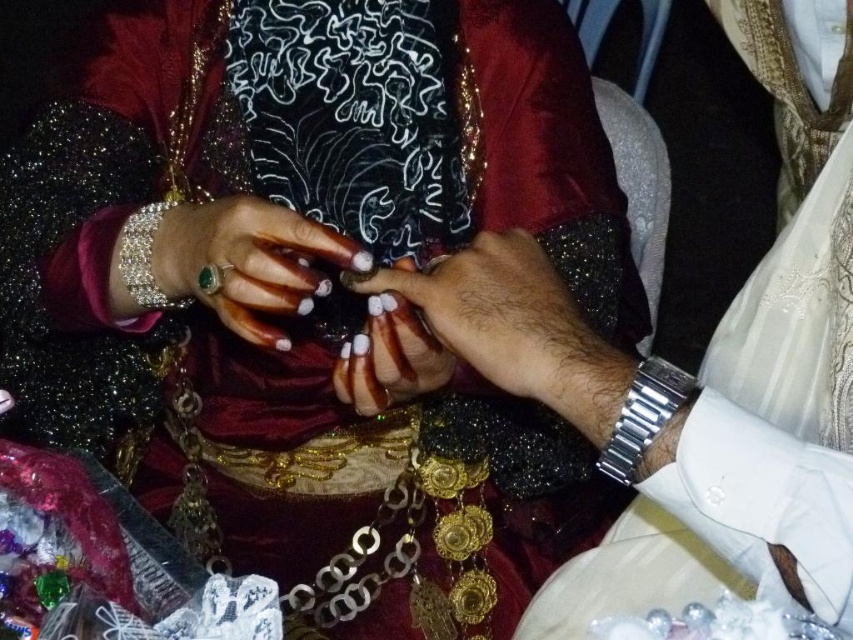
What are the coordinates of the shiny gold necklace at center?

The coordinates of the shiny gold necklace at center are at point (759, 374).

You are an art historian studying the image. You notice the matte gold ring at center and the silver metallic bracelet at left. According to the spatial arrangement, which object is located to the right of the other?

The matte gold ring at center is positioned on the right side of the silver metallic bracelet at left.

Based on the scene description, which object is taller between the shiny gold necklace at center and the silver metallic bracelet at left?

The shiny gold necklace at center is much taller than the silver metallic bracelet at left.